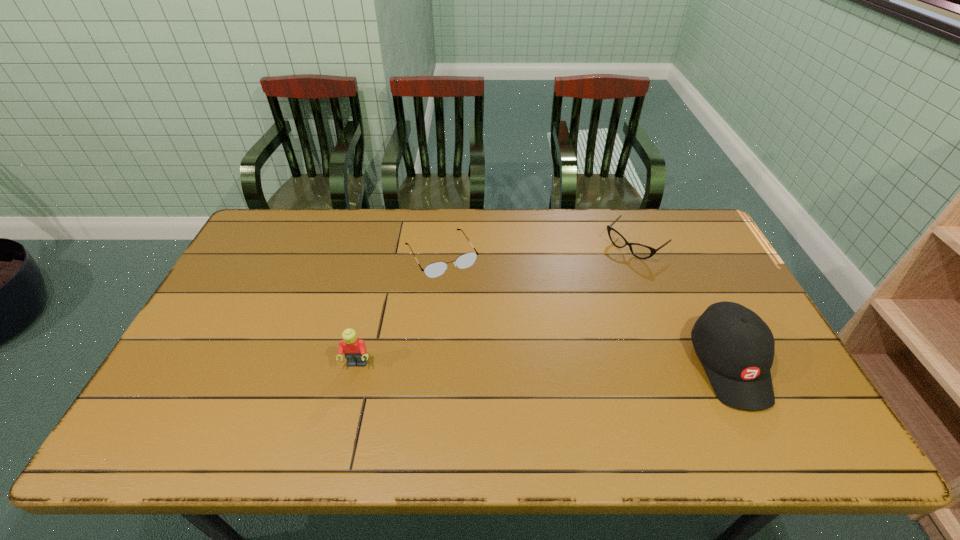
I want to click on Lego, so click(354, 349).

This screenshot has width=960, height=540. In order to click on baseball cap in this screenshot , I will do click(x=736, y=347).

The height and width of the screenshot is (540, 960). What are the coordinates of `the left spectacles` in the screenshot? It's located at (436, 269).

You are a GUI agent. You are given a task and a screenshot of the screen. Output one action in this format:
    pyautogui.click(x=<x>, y=<y>)
    Task: Click on the right spectacles
    This screenshot has height=540, width=960.
    Given the screenshot: What is the action you would take?
    pyautogui.click(x=641, y=251)

This screenshot has height=540, width=960. Identify the location of vacant region located on the face of the leftmost object. (349, 395).

The height and width of the screenshot is (540, 960). Find the location of `vacant point located on the lenses of the left spectacles`. vacant point located on the lenses of the left spectacles is located at coordinates (504, 361).

Identify the location of vacant point located 0.180m on the lenses of the left spectacles. Image resolution: width=960 pixels, height=540 pixels. (479, 319).

The height and width of the screenshot is (540, 960). Find the location of `vacant space located on the lenses of the left spectacles`. vacant space located on the lenses of the left spectacles is located at coordinates (468, 300).

Locate an element on the screen. vacant region located 0.320m on the front-facing side of the right spectacles is located at coordinates (558, 311).

This screenshot has width=960, height=540. In order to click on blank area located on the front-facing side of the right spectacles in this screenshot , I will do `click(608, 268)`.